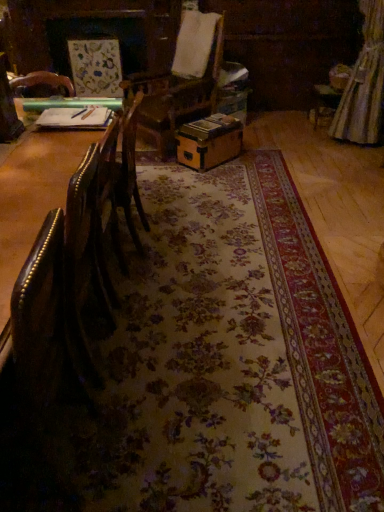
In order to face wooden box at center, should I rotate leftwards or rightwards?

Rotate your view right by about 2.493°.

What do you see at coordinates (209, 142) in the screenshot? I see `wooden box at center` at bounding box center [209, 142].

Describe the element at coordinates (33, 194) in the screenshot. Image resolution: width=384 pixels, height=512 pixels. I see `leather couch at left` at that location.

The image size is (384, 512). In order to click on silky beige curtain at upper right in this screenshot , I will do `click(364, 84)`.

Locate an element on the screen. wooden box at center is located at coordinates (209, 142).

Is leather couch at left to the right of wooden box at center from the viewer's perspective?

Incorrect, leather couch at left is not on the right side of wooden box at center.

Considering the sizes of objects leather couch at left and wooden box at center in the image provided, who is wider, leather couch at left or wooden box at center?

Wider between the two is wooden box at center.

Does leather couch at left contain wooden box at center?

No, wooden box at center is not surrounded by leather couch at left.

Considering the relative sizes of leather couch at left and wooden box at center in the image provided, is leather couch at left bigger than wooden box at center?

Indeed, leather couch at left has a larger size compared to wooden box at center.

Can you tell me how much leather couch at left and silky beige curtain at upper right differ in facing direction?

0.291 degrees separate the facing orientations of leather couch at left and silky beige curtain at upper right.

Between leather couch at left and silky beige curtain at upper right, which one has less height?

leather couch at left.

Can you confirm if leather couch at left is thinner than silky beige curtain at upper right?

Indeed, leather couch at left has a lesser width compared to silky beige curtain at upper right.

Is leather couch at left not close to silky beige curtain at upper right?

Yes, leather couch at left and silky beige curtain at upper right are located far from each other.

In the scene shown: Is silky beige curtain at upper right bigger or smaller than leather couch at left?

Clearly, silky beige curtain at upper right is smaller in size than leather couch at left.

Is silky beige curtain at upper right oriented towards leather couch at left?

No, silky beige curtain at upper right does not turn towards leather couch at left.

The image size is (384, 512). In order to click on curtain located above the leather couch at left (from the image's perspective) in this screenshot , I will do `click(364, 84)`.

Does point (210, 153) come in front of point (26, 148)?

No, (210, 153) is further to viewer.

Identify the location of table above the wooden box at center (from a real-world perspective). (33, 194).

Consider the image. From the image's perspective, would you say wooden box at center is shown under leather couch at left?

No, from the image's perspective, wooden box at center is not below leather couch at left.

Considering the points (364, 92) and (219, 144), which point is in front, point (364, 92) or point (219, 144)?

The point (219, 144) is in front.

Looking at their sizes, would you say silky beige curtain at upper right is wider or thinner than wooden box at center?

In the image, silky beige curtain at upper right appears to be more narrow than wooden box at center.

Who is more distant, silky beige curtain at upper right or wooden box at center?

Positioned behind is silky beige curtain at upper right.

Is silky beige curtain at upper right smaller than wooden box at center?

No, silky beige curtain at upper right is not smaller than wooden box at center.

Between point (195, 137) and point (363, 110), which one is positioned in front?

Positioned in front is point (195, 137).

Does wooden box at center appear on the right side of silky beige curtain at upper right?

No.

From a real-world perspective, is wooden box at center positioned above or below silky beige curtain at upper right?

Clearly, from a real-world perspective, wooden box at center is below silky beige curtain at upper right.

From the image's perspective, between wooden box at center and silky beige curtain at upper right, which one is located above?

silky beige curtain at upper right is shown above in the image.

Identify the location of table above the wooden box at center (from a real-world perspective). Image resolution: width=384 pixels, height=512 pixels. coord(33,194).

At what (x,y) coordinates should I click in order to perform the action: click on curtain that appears above the leather couch at left (from the image's perspective). Please return your answer as a coordinate pair (x, y). Looking at the image, I should click on (364, 84).

Based on the photo, from the image, which object appears to be nearer to silky beige curtain at upper right, wooden box at center or leather couch at left?

wooden box at center is positioned closer to the anchor silky beige curtain at upper right.

When comparing their distances from wooden box at center, does silky beige curtain at upper right or leather couch at left seem closer?

silky beige curtain at upper right is closer to wooden box at center.

From the image, which object appears to be farther from leather couch at left, silky beige curtain at upper right or wooden box at center?

The object further to leather couch at left is silky beige curtain at upper right.

Consider the image. Estimate the real-world distances between objects in this image. Which object is closer to silky beige curtain at upper right, leather couch at left or wooden box at center?

wooden box at center.

From the image, which object appears to be nearer to leather couch at left, wooden box at center or silky beige curtain at upper right?

wooden box at center is closer to leather couch at left.

Considering their positions, is leather couch at left positioned further to wooden box at center than silky beige curtain at upper right?

leather couch at left is further to wooden box at center.

Locate an element on the screen. This screenshot has height=512, width=384. cardboard box between leather couch at left and silky beige curtain at upper right along the z-axis is located at coordinates (209, 142).